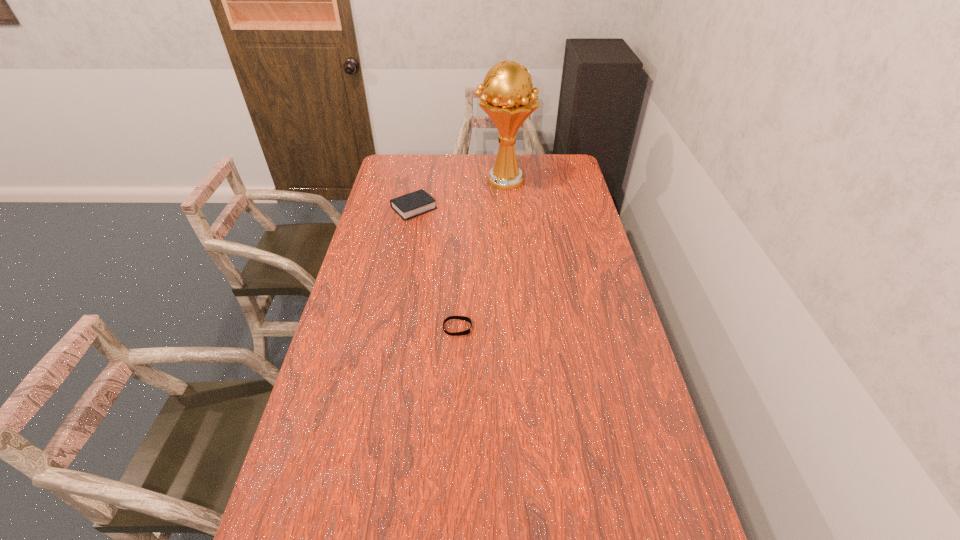
Locate an element on the screen. The height and width of the screenshot is (540, 960). free area in between the wristband and the second shortest object is located at coordinates (436, 268).

This screenshot has width=960, height=540. In order to click on free area in between the nearest object and the tallest object in this screenshot , I will do `click(481, 254)`.

Identify the location of vacant area that lies between the shortest object and the rightmost object. (481, 254).

This screenshot has height=540, width=960. What are the coordinates of `free space that is in between the Bible and the tallest object` in the screenshot? It's located at (459, 194).

Find the location of a particular element. This screenshot has width=960, height=540. free spot between the second nearest object and the trophy_cup is located at coordinates (459, 194).

This screenshot has height=540, width=960. I want to click on vacant space in between the shortest object and the second nearest object, so click(x=436, y=268).

Where is `free spot between the farthest object and the second object from left to right`? Image resolution: width=960 pixels, height=540 pixels. free spot between the farthest object and the second object from left to right is located at coordinates (481, 254).

Select which object appears as the closest to the wristband. Please provide its 2D coordinates. Your answer should be formatted as a tuple, i.e. [(x, y)], where the tuple contains the x and y coordinates of a point satisfying the conditions above.

[(410, 205)]

You are a GUI agent. You are given a task and a screenshot of the screen. Output one action in this format:
    pyautogui.click(x=<x>, y=<y>)
    Task: Click on the object identified as the second closest to the leftmost object
    
    Given the screenshot: What is the action you would take?
    pyautogui.click(x=463, y=318)

The height and width of the screenshot is (540, 960). What are the coordinates of `free location that satisfies the following two spatial constraints: 1. at the front of the tallest object where the globe is prominent; 2. on the front side of the second tallest object` in the screenshot? It's located at (506, 208).